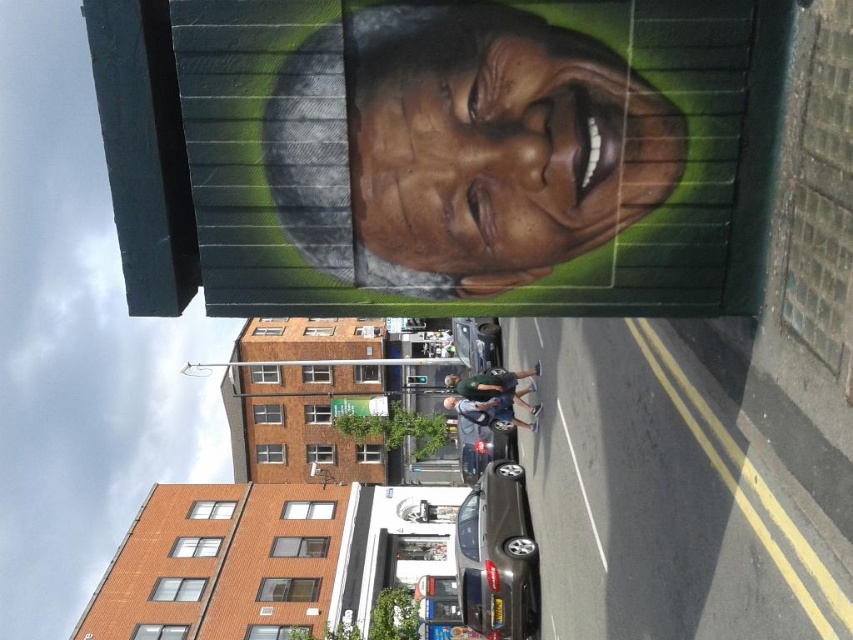
Is metallic gray sedan at center closer to the viewer compared to green fabric shirt at center?

That is True.

Between point (508, 636) and point (492, 372), which one is positioned behind?

The point (492, 372) is more distant.

Locate an element on the screen. The image size is (853, 640). metallic gray sedan at center is located at coordinates (497, 556).

Does matte brown face at upper center appear over green fabric shirt at center?

Correct, matte brown face at upper center is located above green fabric shirt at center.

Which is behind, point (357, 189) or point (508, 385)?

The point (508, 385) is more distant.

I want to click on matte brown face at upper center, so click(x=500, y=145).

Is smooth paint portrait at upper center above green fabric shirt at center?

Yes, smooth paint portrait at upper center is above green fabric shirt at center.

The width and height of the screenshot is (853, 640). Describe the element at coordinates (480, 154) in the screenshot. I see `smooth paint portrait at upper center` at that location.

Measure the distance between smooth paint portrait at upper center and camera.

smooth paint portrait at upper center is 5.22 meters from camera.

The image size is (853, 640). What are the coordinates of `smooth paint portrait at upper center` in the screenshot? It's located at (480, 154).